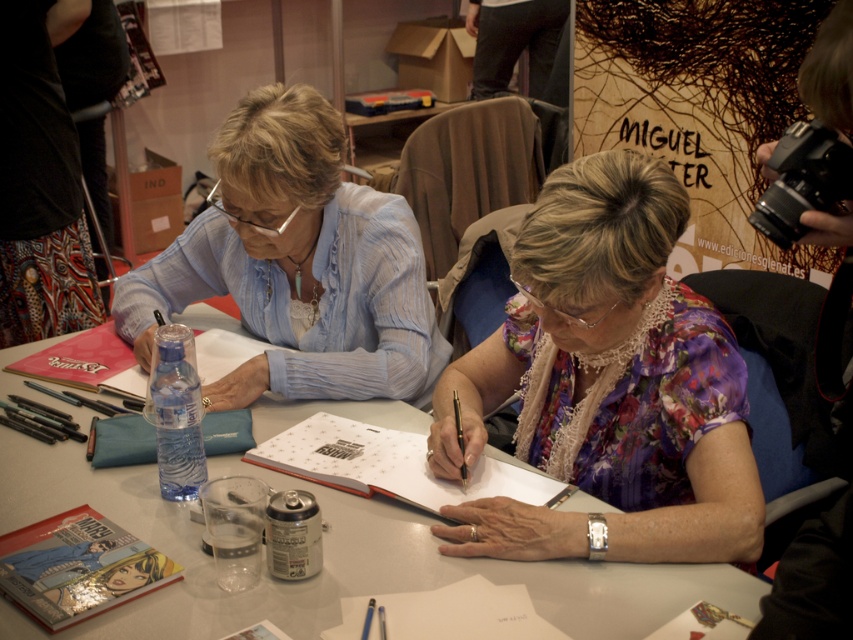
Question: In this image, where is matte blue shirt at center located relative to metallic pen at upper center?

Choices:
 (A) below
 (B) above

Answer: (B)

Question: Is white paper at center above metallic pen at upper center?

Choices:
 (A) yes
 (B) no

Answer: (B)

Question: Among these objects, which one is farthest from the camera?

Choices:
 (A) metallic pen at upper center
 (B) floral silk blouse at center

Answer: (A)

Question: Which point is closer to the camera?

Choices:
 (A) metallic pen at upper center
 (B) white glossy table at center
 (C) white paper at center
 (D) floral silk blouse at center

Answer: (B)

Question: Which point appears closest to the camera in this image?

Choices:
 (A) [x=125, y=284]
 (B) [x=1, y=472]
 (C) [x=460, y=429]

Answer: (C)

Question: Where is floral silk blouse at center located in relation to white paper at center in the image?

Choices:
 (A) above
 (B) below

Answer: (A)